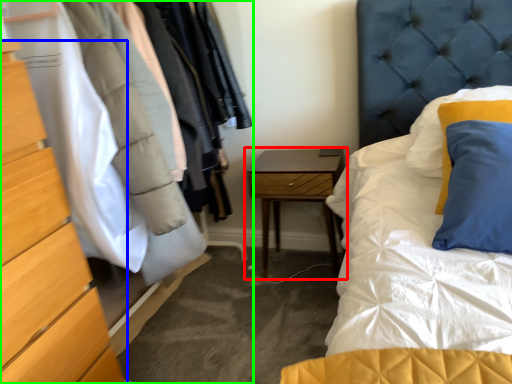
Question: Which object is the farthest from nightstand (highlighted by a red box)? Choose among these: chest of drawers (highlighted by a blue box) or dresser (highlighted by a green box).

Choices:
 (A) chest of drawers
 (B) dresser

Answer: (A)